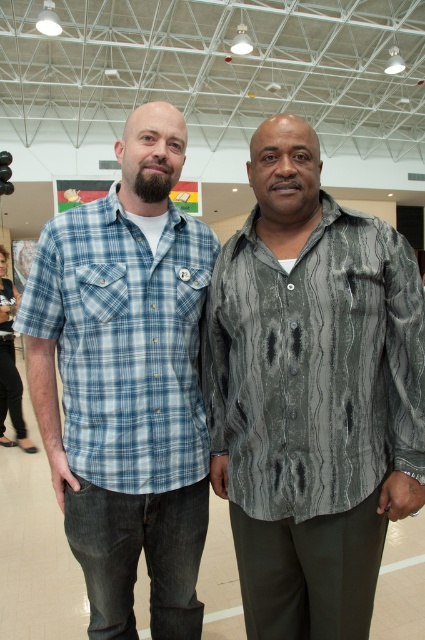
Between point (300, 257) and point (113, 492), which one is positioned in front?

Point (300, 257)

From the picture: Is textured gray shirt at center further to camera compared to blue plaid shirt at center?

No.

Does point (258, 148) lie behind point (76, 552)?

No, it is not.

You are a GUI agent. You are given a task and a screenshot of the screen. Output one action in this format:
    pyautogui.click(x=<x>, y=<y>)
    Task: Click on the textured gray shirt at center
    Image resolution: width=425 pixels, height=640 pixels.
    Given the screenshot: What is the action you would take?
    pyautogui.click(x=311, y=394)